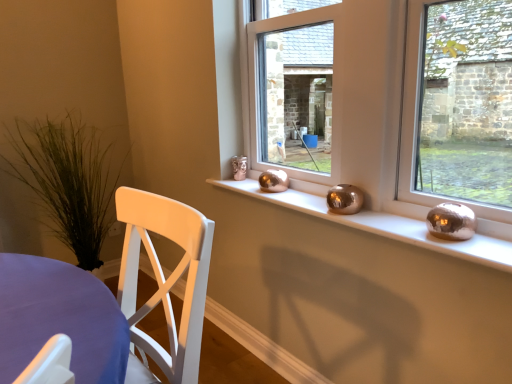
Question: Based on their positions, is metallic gold vase at center located to the left or right of metallic spheres at center?

Choices:
 (A) right
 (B) left

Answer: (B)

Question: From their relative heights in the image, would you say metallic gold vase at center is taller or shorter than metallic spheres at center?

Choices:
 (A) tall
 (B) short

Answer: (A)

Question: Estimate the real-world distances between objects in this image. Which object is closer to the green grass at left?

Choices:
 (A) metallic gold vase at center
 (B) metallic spheres at center

Answer: (B)

Question: Which of these objects is positioned farthest from the green grass at left?

Choices:
 (A) metallic spheres at center
 (B) metallic gold vase at center

Answer: (B)